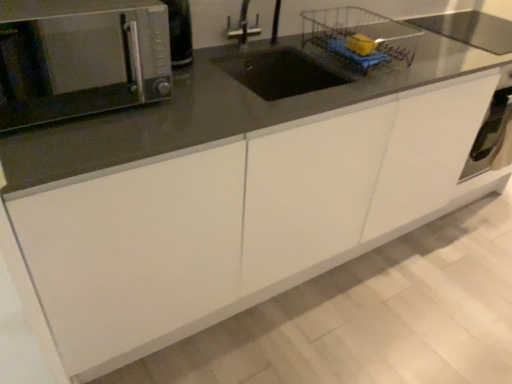
Where is `vacant space in satin silver microwave at upper left (from a real-world perspective)`? The width and height of the screenshot is (512, 384). vacant space in satin silver microwave at upper left (from a real-world perspective) is located at coordinates (86, 106).